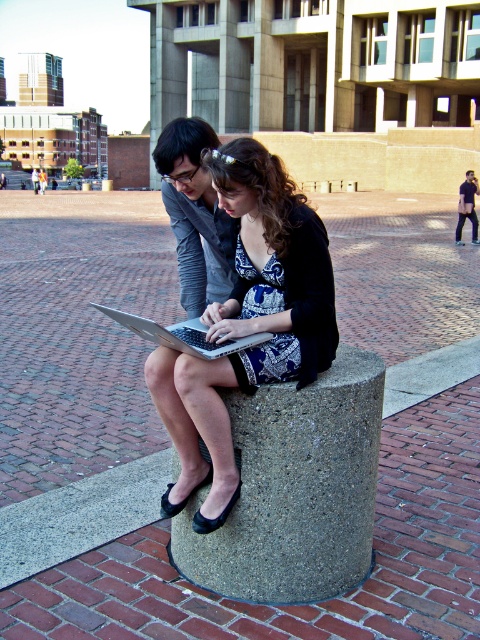
Question: Which of the following is the closest to the observer?

Choices:
 (A) (226, 348)
 (B) (312, 236)
 (C) (217, 538)

Answer: (A)

Question: Does patterned fabric dress at center appear on the left side of silver metallic laptop at center?

Choices:
 (A) yes
 (B) no

Answer: (B)

Question: Can you confirm if gray concrete at center is positioned below silver metallic laptop at center?

Choices:
 (A) yes
 (B) no

Answer: (A)

Question: Estimate the real-world distances between objects in this image. Which object is farther from the patterned fabric dress at center?

Choices:
 (A) silver metallic laptop at center
 (B) gray concrete at center

Answer: (A)

Question: Which object appears farthest from the camera in this image?

Choices:
 (A) silver metallic laptop at center
 (B) gray concrete at center

Answer: (B)

Question: Is gray concrete at center closer to the viewer compared to silver metallic laptop at center?

Choices:
 (A) yes
 (B) no

Answer: (B)